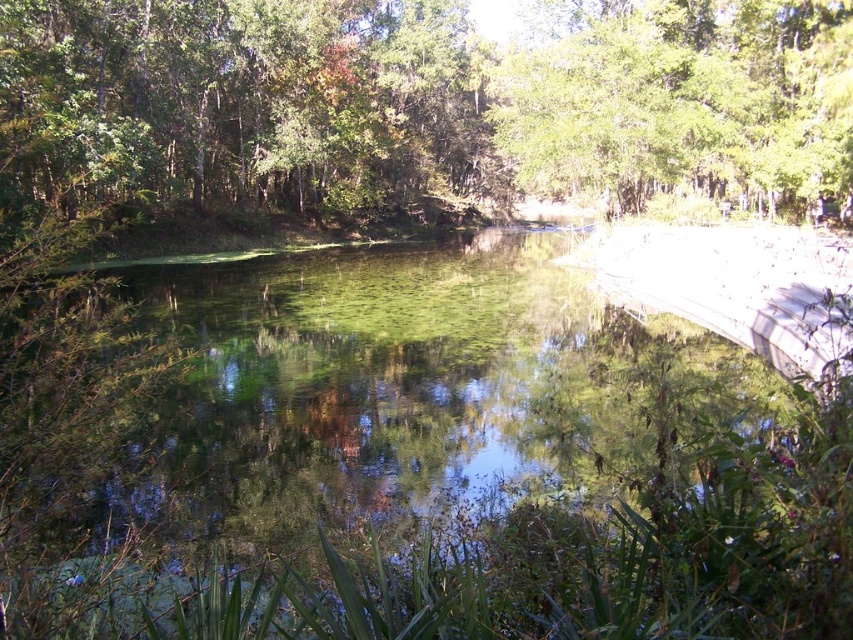
Based on the photo, you are standing at the concrete structure on the right side of the image. There are two points in the scene labeled as point 1 at coordinates (614, 307) and point 2 at coordinates (567, 157). Which point is closer to you?

Point 1 at coordinates (614, 307) is closer to the viewer than point 2 at coordinates (567, 157).

You are standing on the concrete structure on the right side of the image. Looking towards the center, which object do you see first, the green reflective water at center or the green leafy trees at upper center?

The green leafy trees at upper center are seen first because they are positioned to the right of the green reflective water at center, making them closer to your viewpoint on the concrete structure.